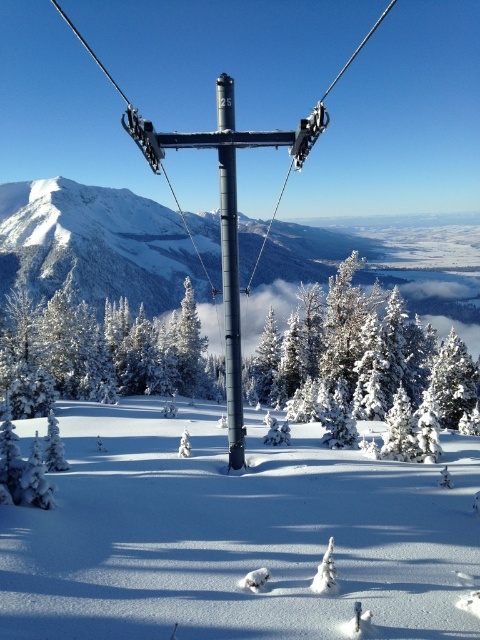
You are standing at the base of the ski lift pole marked with the number 25. You want to walk directly towards the white snow at center. According to the coordinates provided, in which direction should you walk relative to the ski lift pole?

The white snow at center is located at coordinates point (x=233, y=534), so you should walk towards the direction of the coordinates relative to the ski lift pole.

You are a skier planning to take a photo of the metallic pole at center from the white snow at center. Will the pole be fully visible in the photo without any obstruction from the snow?

The white snow at center is shorter than the metallic pole at center, so the pole will be fully visible in the photo without any obstruction from the snow.

In the scene shown: You are a photographer trying to capture the metallic pole at center and the white snow at center in a single frame. Based on their sizes in the image, which one would appear larger in your photo?

The metallic pole at center appears larger in the photo than the white snow at center because the white snow at center is smaller than the metallic pole at center.